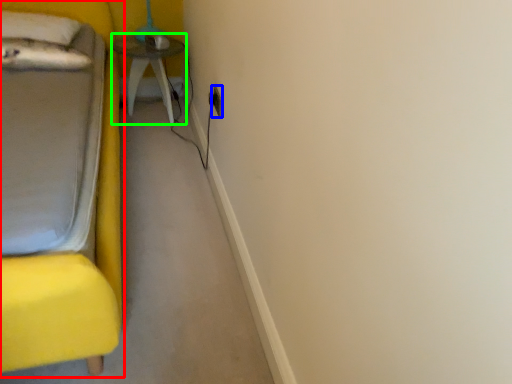
Question: Considering the real-world distances, which object is closest to furniture (highlighted by a red box)? electric outlet (highlighted by a blue box) or table (highlighted by a green box).

Choices:
 (A) electric outlet
 (B) table

Answer: (B)